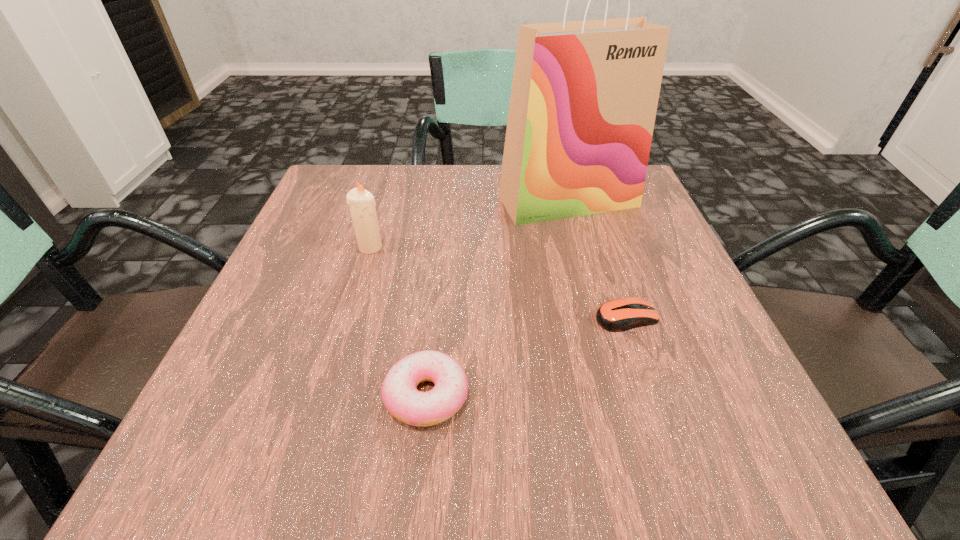
The width and height of the screenshot is (960, 540). In the image, there is a desktop. Identify the location of free space at the left edge. (336, 255).

The width and height of the screenshot is (960, 540). Identify the location of blank area at the right edge. (746, 387).

Find the location of a particular element. blank space at the far left corner is located at coordinates (335, 214).

Find the location of a particular element. This screenshot has width=960, height=540. vacant space at the near left corner of the desktop is located at coordinates (282, 417).

At what (x,y) coordinates should I click in order to perform the action: click on free space at the near right corner of the desktop. Please return your answer as a coordinate pair (x, y). The image size is (960, 540). Looking at the image, I should click on (782, 446).

You are a GUI agent. You are given a task and a screenshot of the screen. Output one action in this format:
    pyautogui.click(x=<x>, y=<y>)
    Task: Click on the unoccupied area between the leftmost object and the doughnut
    
    Given the screenshot: What is the action you would take?
    pyautogui.click(x=398, y=321)

Locate an element on the screen. empty location between the third object from right to left and the farthest object is located at coordinates (497, 298).

The width and height of the screenshot is (960, 540). What are the coordinates of `empty location between the third shortest object and the shopping bag` in the screenshot? It's located at (469, 224).

Locate an element on the screen. The height and width of the screenshot is (540, 960). vacant space in between the shortest object and the farthest object is located at coordinates (597, 259).

Locate an element on the screen. The height and width of the screenshot is (540, 960). vacant region between the tallest object and the second nearest object is located at coordinates (597, 259).